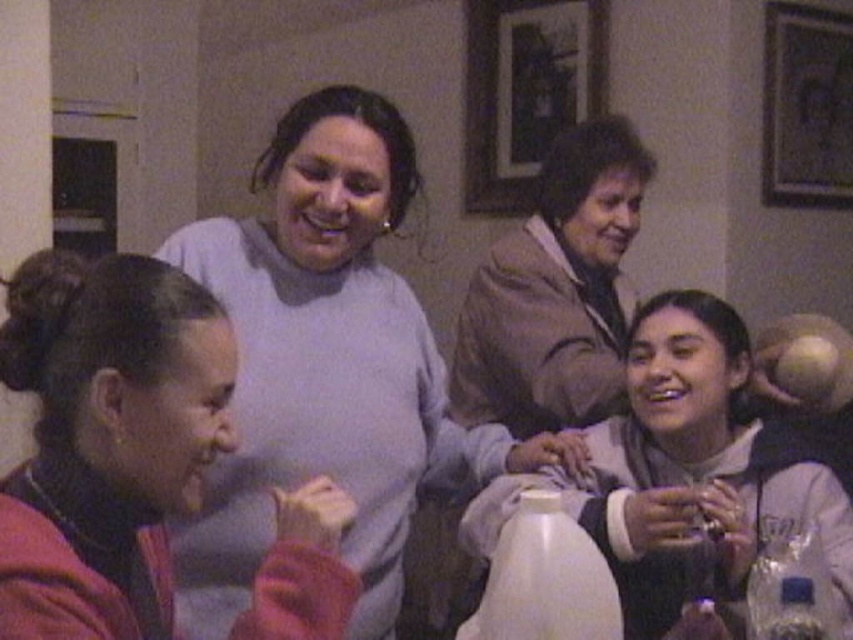
You are a photographer standing at the camera position. You want to take a photo of the scene but need to ensure that the point at coordinates point (79, 300) is in focus. What is the minimum distance you need to set your camera focus to capture this point clearly?

The minimum distance you need to set your camera focus to capture the point (79, 300) clearly is 35.84 inches, as that is the distance of the point from the camera.

You are a guest at a party and you see the wooden picture frame at upper center and the white glossy bottle at lower center. Which object is higher up in the image?

The wooden picture frame at upper center is higher up in the image than the white glossy bottle at lower center.

Based on the scene description, where is the wooden picture frame at upper center located in the image?

The wooden picture frame at upper center is located at point (x=521, y=93).